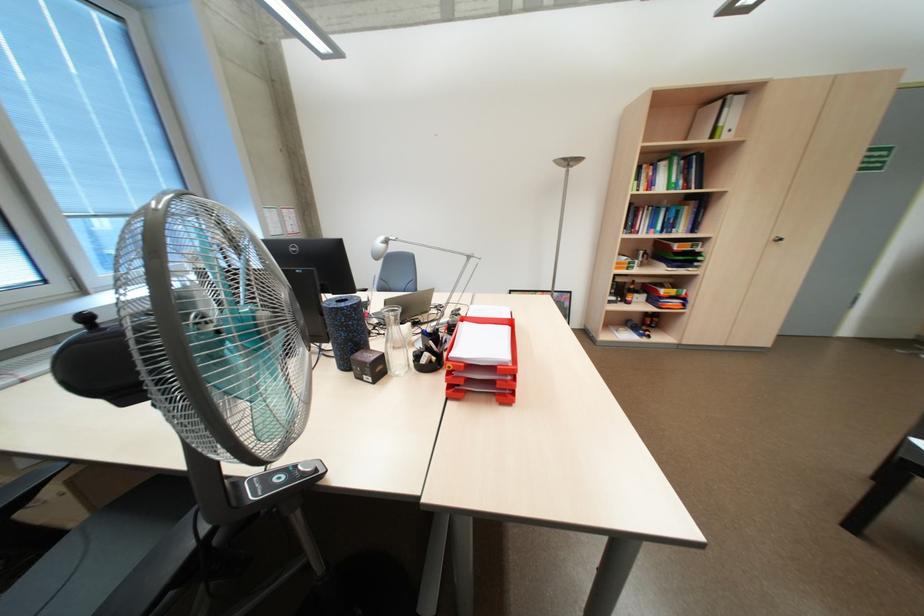
This screenshot has height=616, width=924. I want to click on cabinet door handle, so click(777, 238).